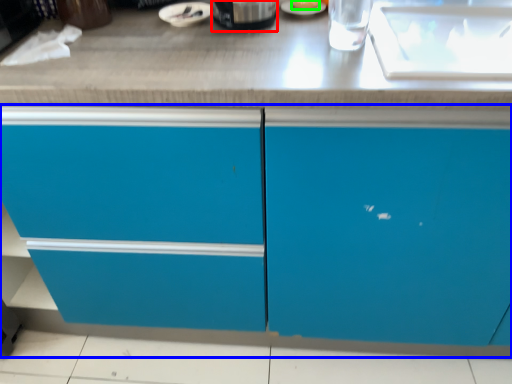
Question: Which is farther away from appliance (highlighted by a red box)? cabinetry (highlighted by a blue box) or food (highlighted by a green box)?

Choices:
 (A) cabinetry
 (B) food

Answer: (A)